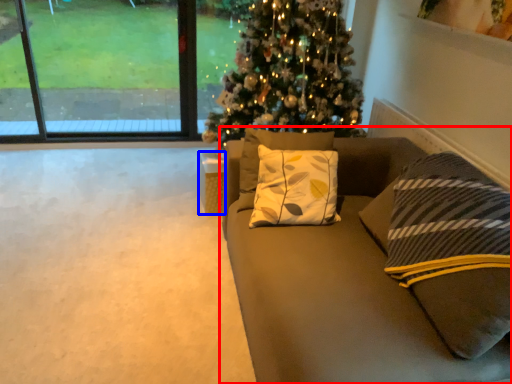
Question: Which object is further to the camera taking this photo, studio couch (highlighted by a red box) or furniture (highlighted by a blue box)?

Choices:
 (A) studio couch
 (B) furniture

Answer: (B)